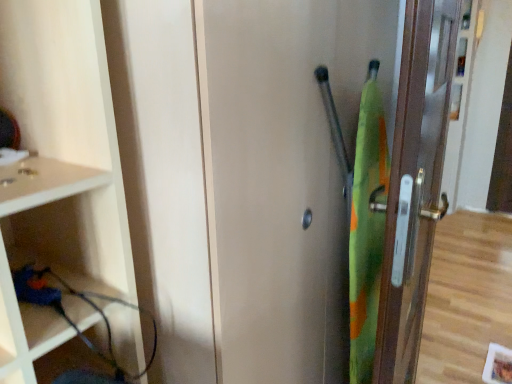
Measure the distance between metallic gold door at right and camera.

metallic gold door at right and camera are 25.76 inches apart from each other.

What do you see at coordinates (415, 184) in the screenshot?
I see `metallic gold door at right` at bounding box center [415, 184].

You are a GUI agent. You are given a task and a screenshot of the screen. Output one action in this format:
    pyautogui.click(x=<x>, y=<y>)
    Task: Click on the metallic gold door at right
    The height and width of the screenshot is (384, 512).
    Given the screenshot: What is the action you would take?
    pyautogui.click(x=415, y=184)

Measure the distance between green fabric screen door at right and camera.

They are 59.77 centimeters apart.

I want to click on green fabric screen door at right, so click(284, 176).

This screenshot has width=512, height=384. Describe the element at coordinates (284, 176) in the screenshot. I see `green fabric screen door at right` at that location.

This screenshot has height=384, width=512. Identify the location of metallic gold door at right. (415, 184).

Is metallic gold door at right at the left side of green fabric screen door at right?

In fact, metallic gold door at right is to the right of green fabric screen door at right.

Is the position of metallic gold door at right less distant than that of green fabric screen door at right?

No, it is not.

Which is in front, point (404, 191) or point (331, 46)?

Positioned in front is point (404, 191).

Consider the image. From the image's perspective, which is above, metallic gold door at right or green fabric screen door at right?

From the image's view, metallic gold door at right is above.

From a real-world perspective, which object rests below the other?

green fabric screen door at right is physically lower.

Can you confirm if metallic gold door at right is wider than green fabric screen door at right?

Correct, the width of metallic gold door at right exceeds that of green fabric screen door at right.

Which of these two, metallic gold door at right or green fabric screen door at right, stands shorter?

metallic gold door at right is shorter.

Is metallic gold door at right bigger or smaller than green fabric screen door at right?

Clearly, metallic gold door at right is smaller in size than green fabric screen door at right.

Is green fabric screen door at right surrounded by metallic gold door at right?

Actually, green fabric screen door at right is outside metallic gold door at right.

Looking at this image, are metallic gold door at right and green fabric screen door at right located far from each other?

No.

Could you tell me if metallic gold door at right is turned towards green fabric screen door at right?

No, metallic gold door at right is not aimed at green fabric screen door at right.

How many degrees apart are the facing directions of metallic gold door at right and green fabric screen door at right?

The angular difference between metallic gold door at right and green fabric screen door at right is 84 degrees.

Identify the location of screen door to the left of metallic gold door at right. (284, 176).

Does green fabric screen door at right appear on the right side of metallic gold door at right?

Incorrect, green fabric screen door at right is not on the right side of metallic gold door at right.

Is the depth of green fabric screen door at right greater than that of metallic gold door at right?

No, it is in front of metallic gold door at right.

Is point (277, 208) in front of point (404, 377)?

Yes, point (277, 208) is closer to viewer.

From the image's perspective, is green fabric screen door at right below metallic gold door at right?

Yes, from the image's perspective, green fabric screen door at right is beneath metallic gold door at right.

From a real-world perspective, is green fabric screen door at right above or below metallic gold door at right?

From a real-world perspective, green fabric screen door at right is physically below metallic gold door at right.

Which of these two, green fabric screen door at right or metallic gold door at right, is wider?

Wider between the two is metallic gold door at right.

Who is shorter, green fabric screen door at right or metallic gold door at right?

Standing shorter between the two is metallic gold door at right.

Does green fabric screen door at right have a smaller size compared to metallic gold door at right?

Actually, green fabric screen door at right might be larger than metallic gold door at right.

Choose the correct answer: Is green fabric screen door at right inside metallic gold door at right or outside it?

green fabric screen door at right exists outside the volume of metallic gold door at right.

Is green fabric screen door at right far from metallic gold door at right?

green fabric screen door at right is near metallic gold door at right, not far away.

Does green fabric screen door at right turn towards metallic gold door at right?

Yes, green fabric screen door at right is oriented towards metallic gold door at right.

How many degrees apart are the facing directions of green fabric screen door at right and metallic gold door at right?

The facing directions of green fabric screen door at right and metallic gold door at right are 84 degrees apart.

Locate an element on the screen. Image resolution: width=512 pixels, height=384 pixels. door on the right of green fabric screen door at right is located at coordinates (415, 184).

Find the location of `screen door below the metallic gold door at right (from the image's perspective)`. screen door below the metallic gold door at right (from the image's perspective) is located at coordinates pyautogui.click(x=284, y=176).

I want to click on screen door located in front of the metallic gold door at right, so click(284, 176).